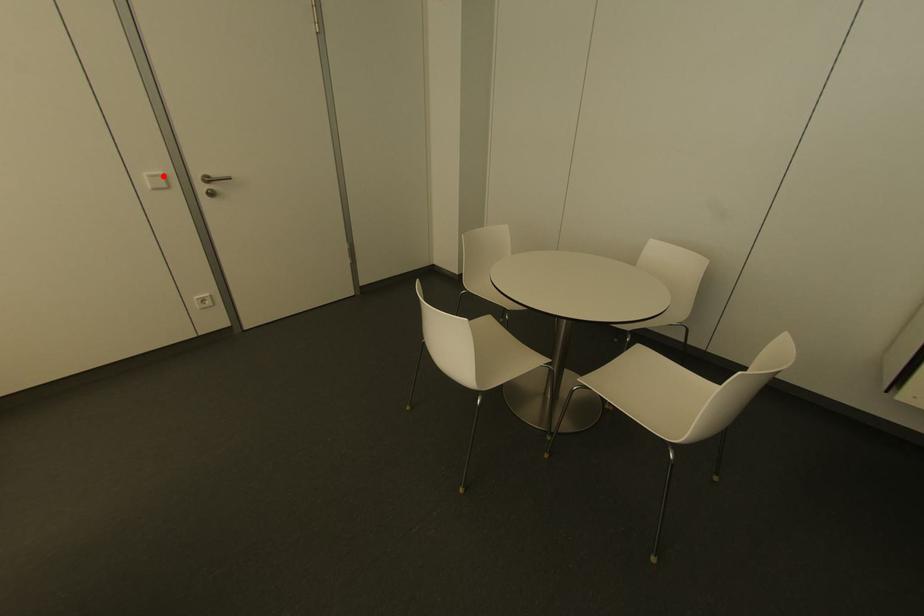
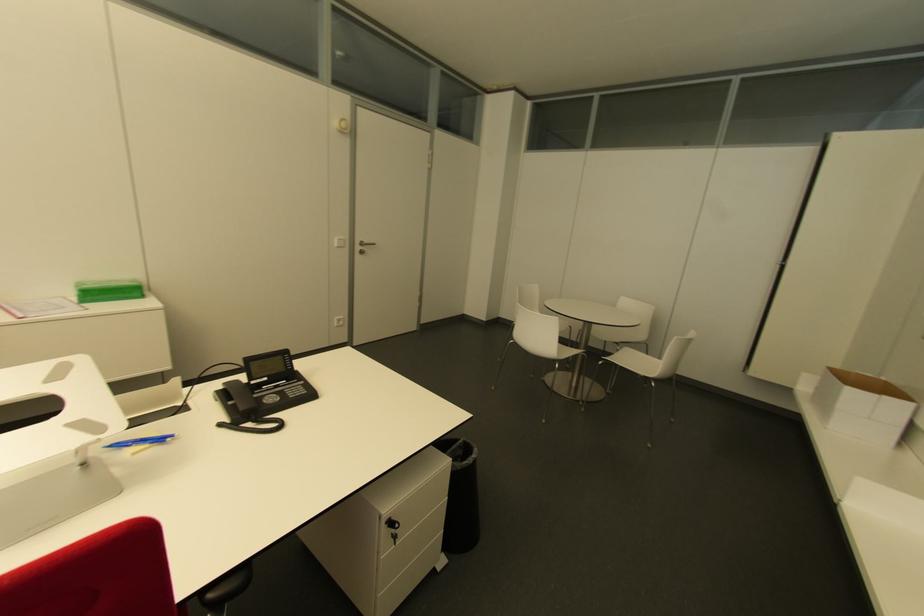
The point at the highlighted location is marked in the first image. Where is the corresponding point in the second image?

(343, 240)